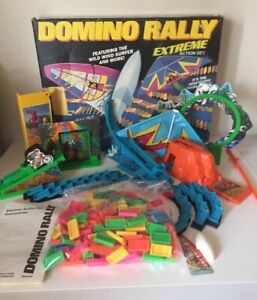
Image resolution: width=257 pixels, height=300 pixels. I want to click on white square table, so click(x=16, y=146).